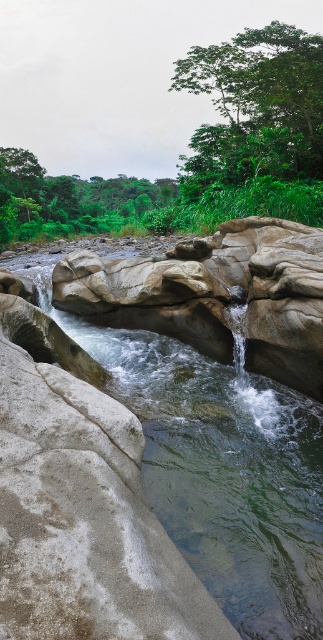
Is green leafy tree at upper right positioned at the back of green leafy tree at upper left?

No.

Does green leafy tree at upper right appear on the right side of green leafy tree at upper left?

Correct, you'll find green leafy tree at upper right to the right of green leafy tree at upper left.

Image resolution: width=323 pixels, height=640 pixels. Describe the element at coordinates (256, 106) in the screenshot. I see `green leafy tree at upper right` at that location.

At what (x,y) coordinates should I click in order to perform the action: click on green leafy tree at upper right. Please return your answer as a coordinate pair (x, y). Image resolution: width=323 pixels, height=640 pixels. Looking at the image, I should click on (256, 106).